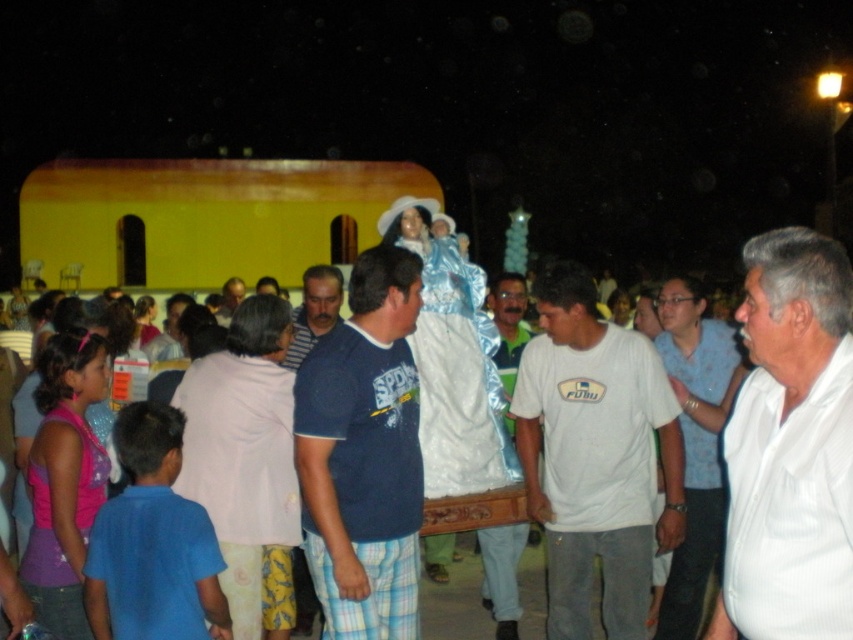
You are a photographer at the religious procession. You want to capture a photo of the blue cotton shirt at center and white cotton shirt at center. Which one should you zoom in on if you want to focus on the smaller one?

The blue cotton shirt at center has a smaller size compared to the white cotton shirt at center, so you should zoom in on the blue cotton shirt at center to focus on the smaller one.